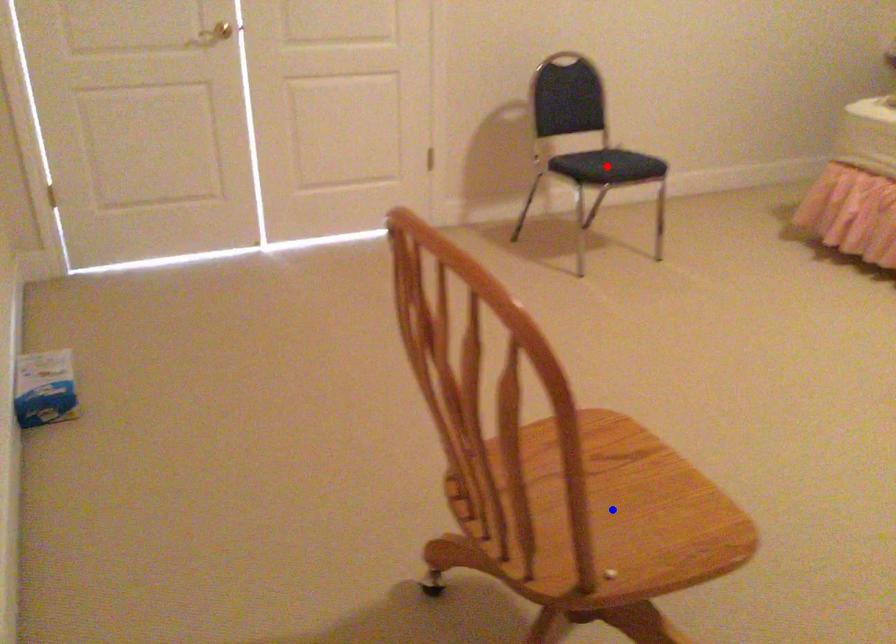
Question: Which of the two points in the image is closer to the camera?

Choices:
 (A) Blue point is closer.
 (B) Red point is closer.

Answer: (A)